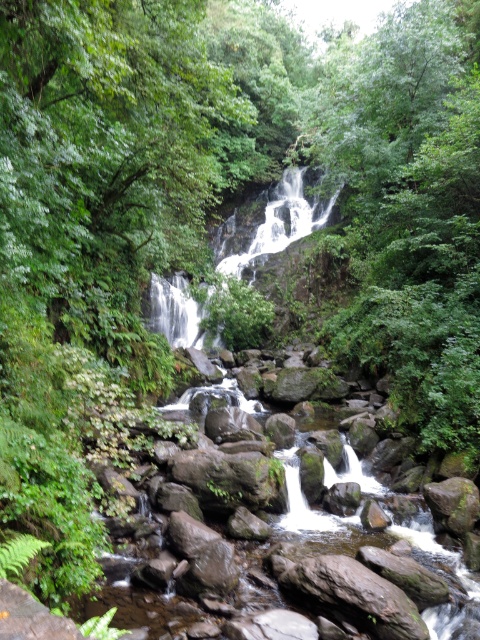
Question: Which point is closer to the camera?

Choices:
 (A) white smooth waterfall at center
 (B) green mossy rock at center

Answer: (B)

Question: Is green mossy rock at center above white smooth waterfall at center?

Choices:
 (A) yes
 (B) no

Answer: (B)

Question: Can you confirm if green mossy rock at center is wider than white smooth waterfall at center?

Choices:
 (A) no
 (B) yes

Answer: (B)

Question: In this image, where is green mossy rock at center located relative to white smooth waterfall at center?

Choices:
 (A) below
 (B) above

Answer: (A)